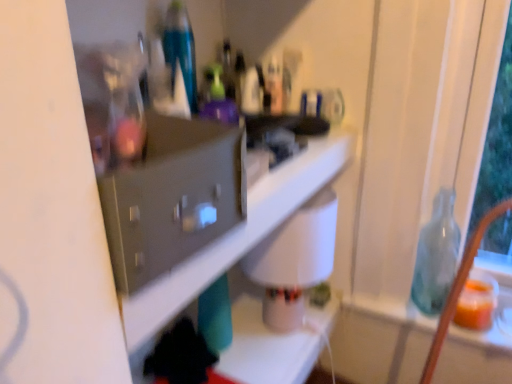
Question: Is the depth of white glossy shelf at center less than that of translucent glass bottle at right?

Choices:
 (A) yes
 (B) no

Answer: (A)

Question: From a real-world perspective, is white glossy shelf at center located higher than translucent glass bottle at right?

Choices:
 (A) yes
 (B) no

Answer: (A)

Question: Is translucent glass bottle at right completely or partially inside white glossy shelf at center?

Choices:
 (A) yes
 (B) no

Answer: (B)

Question: Is white glossy shelf at center thinner than translucent glass bottle at right?

Choices:
 (A) yes
 (B) no

Answer: (B)

Question: From the image's perspective, is white glossy shelf at center under translucent glass bottle at right?

Choices:
 (A) no
 (B) yes

Answer: (A)

Question: From a real-world perspective, is white glossy shelf at center beneath translucent glass bottle at right?

Choices:
 (A) yes
 (B) no

Answer: (B)

Question: Can you confirm if translucent glass bottle at right is positioned to the right of white glossy shelf at center?

Choices:
 (A) yes
 (B) no

Answer: (A)

Question: From a real-world perspective, does translucent glass bottle at right stand above white glossy shelf at center?

Choices:
 (A) no
 (B) yes

Answer: (A)

Question: Can you confirm if translucent glass bottle at right is bigger than white glossy shelf at center?

Choices:
 (A) no
 (B) yes

Answer: (A)

Question: Can you confirm if translucent glass bottle at right is thinner than white glossy shelf at center?

Choices:
 (A) yes
 (B) no

Answer: (A)

Question: Is the depth of translucent glass bottle at right greater than that of white glossy shelf at center?

Choices:
 (A) no
 (B) yes

Answer: (B)

Question: Can you confirm if translucent glass bottle at right is taller than white glossy shelf at center?

Choices:
 (A) no
 (B) yes

Answer: (B)

Question: Visually, is white glossy shelf at center positioned to the left or to the right of translucent glass bottle at right?

Choices:
 (A) left
 (B) right

Answer: (A)